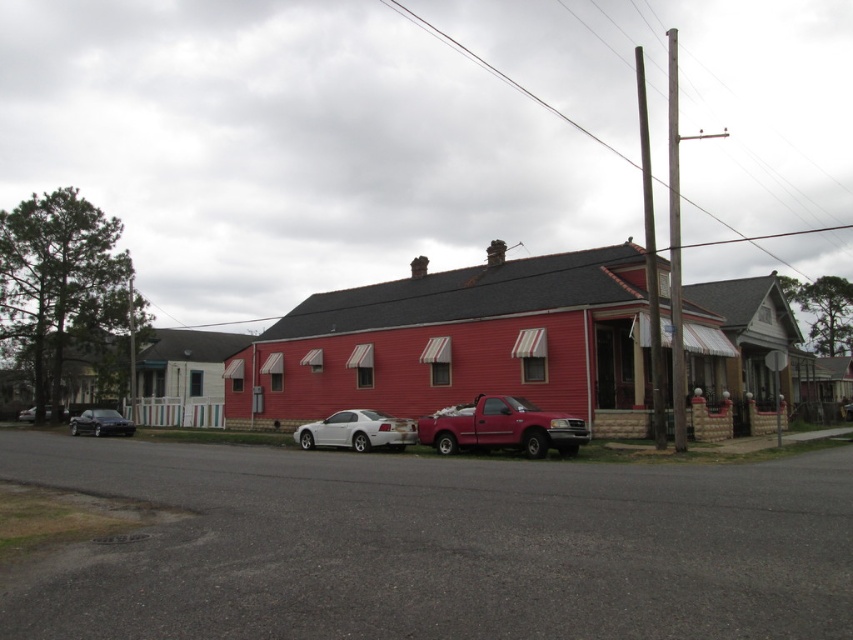
Question: Based on their relative distances, which object is farther from the white glossy car at center?

Choices:
 (A) matte red pickup truck at center
 (B) shiny black sedan at left

Answer: (B)

Question: Does matte red pickup truck at center have a lesser width compared to shiny black sedan at left?

Choices:
 (A) yes
 (B) no

Answer: (A)

Question: Based on their relative distances, which object is farther from the white glossy car at center?

Choices:
 (A) shiny black sedan at lower left
 (B) matte red pickup truck at center
 (C) shiny black sedan at left

Answer: (C)

Question: Among these objects, which one is nearest to the camera?

Choices:
 (A) shiny black sedan at lower left
 (B) white glossy car at center
 (C) matte red pickup truck at center

Answer: (C)

Question: Is white glossy car at center positioned at the back of shiny black sedan at lower left?

Choices:
 (A) yes
 (B) no

Answer: (B)

Question: Can you confirm if white glossy car at center is thinner than shiny black sedan at lower left?

Choices:
 (A) no
 (B) yes

Answer: (B)